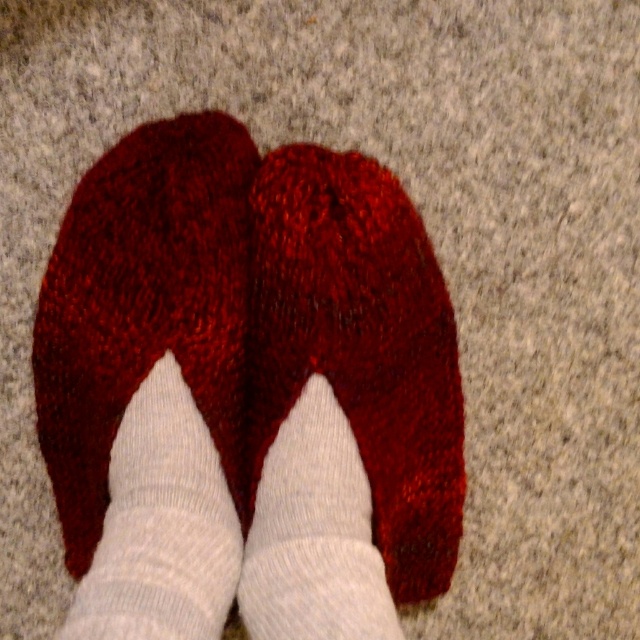
You are standing in a room and see the point at coordinates point (442, 403). If you want to place a small plant pot that requires 1 meter of space between it and the point, can you place it directly in front of you?

The distance between point (442, 403) and the viewer is 1.17 meters. Since the required space is 1 meter, placing the plant pot directly in front of you would be possible as the distance exceeds the required minimum.

You are a delivery robot in a cozy indoor setting. You need to place a small package on the floor near the shiny red slippers at center without blocking the path. Where should you place the package?

The shiny red slippers at center are located at point [253,323]. You should place the package near this coordinate but ensure it doesn not obstruct the path.

You are trying to place a decorative mat exactly at the center of the room. The shiny red slippers at center are currently occupying the spot. Can you move the mat to the nearest available space without moving the slippers?

The shiny red slippers at center are located at point (253,323), so the nearest available space would be either to the left or right of them, maintaining the same distance from the center as their position.